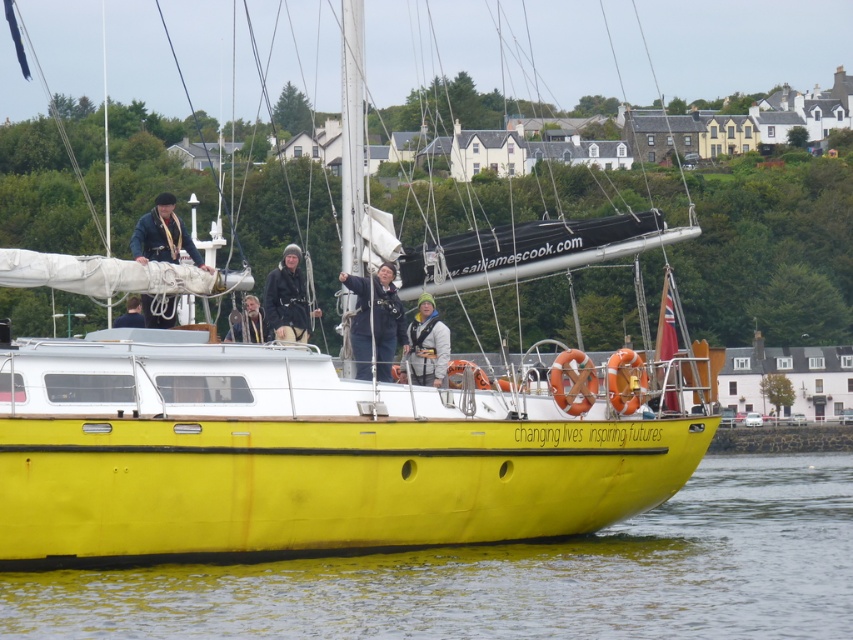
You are a photographer taking a picture of the scene. The matte blue jacket at upper left and the orange rubber life jacket at right are both in your frame. Which object should you focus on if you want to capture the taller one?

The matte blue jacket at upper left is much taller than the orange rubber life jacket at right, so you should focus on the matte blue jacket at upper left to capture the taller one.

From the picture: You are a photographer trying to capture a closeup of the dark gray knit hat at center and the orange rubber life jacket at center. Since you want to focus on both items equally, which one should you zoom in on more?

The dark gray knit hat at center is wider than the orange rubber life jacket at center, so you should zoom in more on the orange rubber life jacket at center to ensure both items appear equally sized in the photo.

Based on the photo, you are a photographer on the deck of the yellow sailboat. You want to take a photo of the matte blue jacket at upper left and the orange rubber life jacket at right. Which object should you focus on first if you want to capture both in one frame without moving the camera?

You should focus on the matte blue jacket at upper left first because it is closer to the viewer than the orange rubber life jacket at right, allowing both to be in focus when using a single focal point.